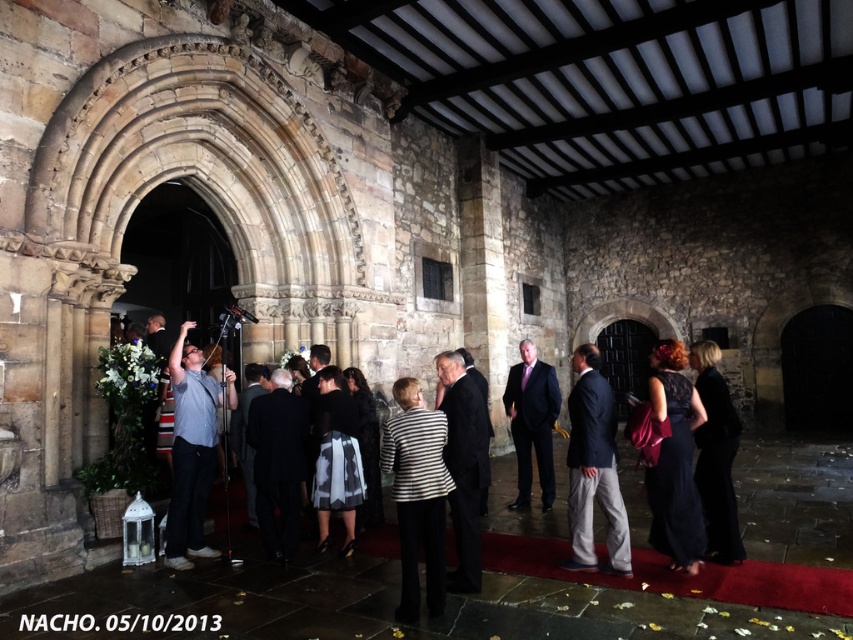
Question: Which object appears farthest from the camera in this image?

Choices:
 (A) striped fabric jacket at center
 (B) dark blue suit at center
 (C) velvet black dress at center

Answer: (B)

Question: Does striped fabric jacket at center have a greater width compared to velvet black dress at center?

Choices:
 (A) no
 (B) yes

Answer: (A)

Question: From the image, what is the correct spatial relationship of smooth stone steps at center in relation to matte black suit at center?

Choices:
 (A) right
 (B) left

Answer: (A)

Question: Considering the relative positions of dark blue suit at center and gray fabric shirt at center in the image provided, where is dark blue suit at center located with respect to gray fabric shirt at center?

Choices:
 (A) above
 (B) below

Answer: (B)

Question: Which object appears closest to the camera in this image?

Choices:
 (A) dark suit at center
 (B) velvet black dress at center
 (C) gray fabric shirt at center
 (D) dark gray suit at center

Answer: (D)

Question: Which object is positioned farthest from the matte black suit at center?

Choices:
 (A) velvet black dress at center
 (B) black silk dress at lower right
 (C) dark suit at center
 (D) dark blue suit at center

Answer: (C)